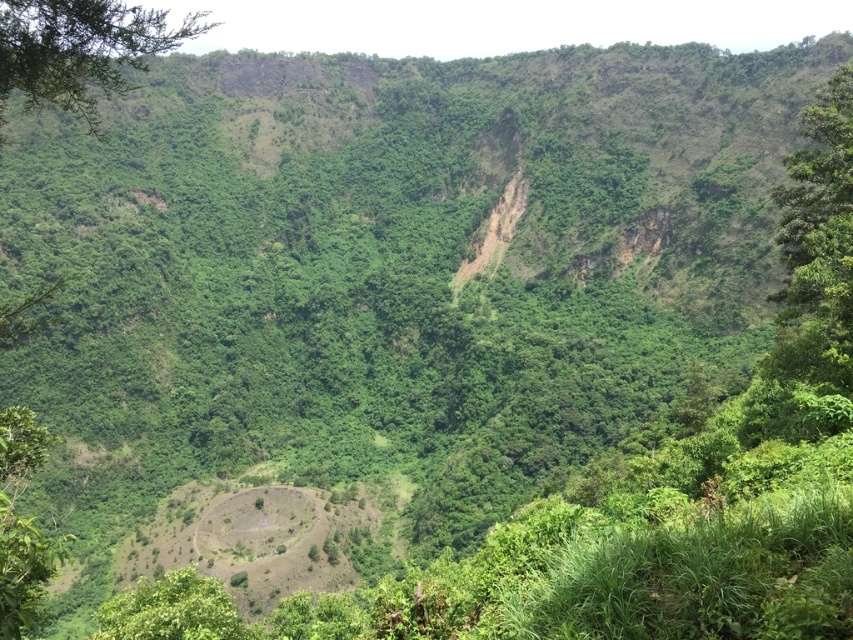
Question: Which point appears closest to the camera in this image?

Choices:
 (A) tap(129, 36)
 (B) tap(822, 266)

Answer: (A)

Question: Can you confirm if green leafy tree at right is bigger than green leafy tree at upper left?

Choices:
 (A) yes
 (B) no

Answer: (B)

Question: Does green leafy tree at right have a larger size compared to green leafy tree at upper left?

Choices:
 (A) yes
 (B) no

Answer: (B)

Question: Does green leafy tree at right lie behind green leafy tree at upper left?

Choices:
 (A) yes
 (B) no

Answer: (A)

Question: Which point is closer to the camera?

Choices:
 (A) (828, 147)
 (B) (51, 51)

Answer: (B)